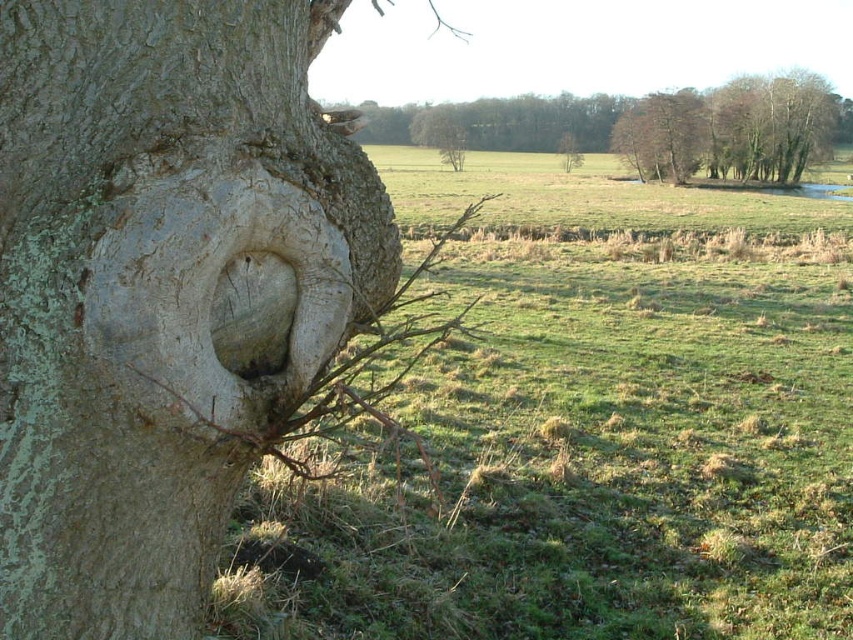
Question: Which of these objects is positioned closest to the smooth bark tree at upper right?

Choices:
 (A) green grass at left
 (B) green rough bark tree at center

Answer: (B)

Question: Which of these objects is positioned farthest from the smooth bark tree at upper right?

Choices:
 (A) smooth bark branch at center
 (B) smooth gray bark at center

Answer: (B)

Question: Does smooth gray bark at center appear over smooth bark tree at upper right?

Choices:
 (A) yes
 (B) no

Answer: (B)

Question: Which of the following is the closest to the observer?

Choices:
 (A) (564, 240)
 (B) (329, 476)

Answer: (B)

Question: Is smooth gray bark at center bigger than green rough bark tree at center?

Choices:
 (A) yes
 (B) no

Answer: (A)

Question: Does smooth gray bark at center appear over smooth bark branch at center?

Choices:
 (A) yes
 (B) no

Answer: (B)